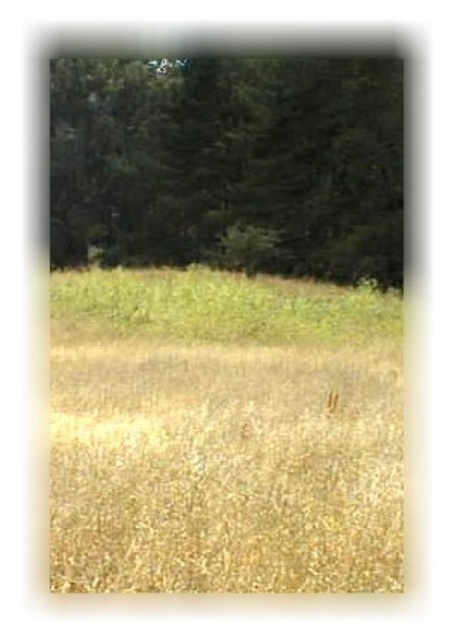
Is dry grass at center wider than green matte tree at upper center?

Incorrect, dry grass at center's width does not surpass green matte tree at upper center's.

Can you confirm if dry grass at center is taller than green matte tree at upper center?

In fact, dry grass at center may be shorter than green matte tree at upper center.

The height and width of the screenshot is (640, 452). Describe the element at coordinates (224, 433) in the screenshot. I see `dry grass at center` at that location.

The height and width of the screenshot is (640, 452). What are the coordinates of `dry grass at center` in the screenshot? It's located at (224, 433).